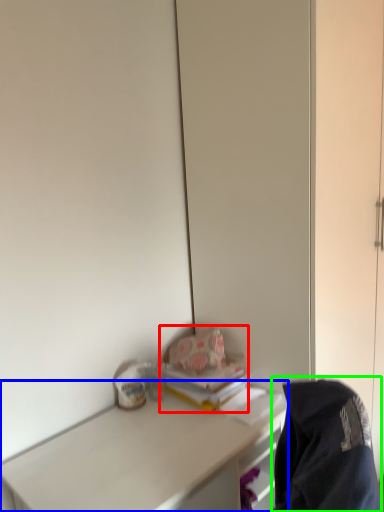
Question: Which object is positioned farthest from book (highlighted by a red box)? Select from desk (highlighted by a blue box) and jacket (highlighted by a green box).

Choices:
 (A) desk
 (B) jacket

Answer: (B)